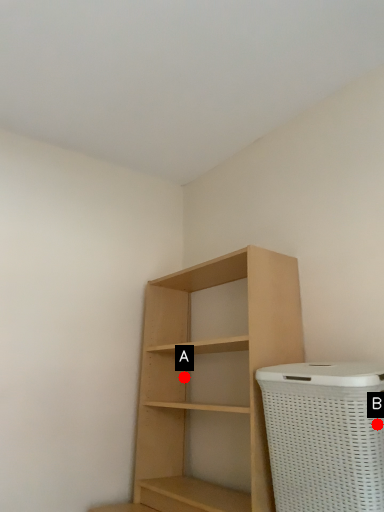
Question: Two points are circled on the image, labeled by A and B beside each circle. Which point is closer to the camera?

Choices:
 (A) A is closer
 (B) B is closer

Answer: (B)